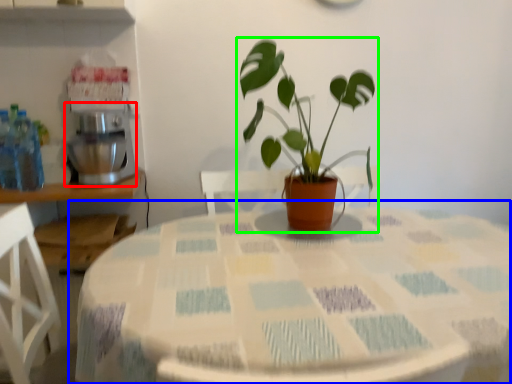
Question: Which object is positioned closest to mixer (highlighted by a red box)? Select from table (highlighted by a blue box) and houseplant (highlighted by a green box).

Choices:
 (A) table
 (B) houseplant

Answer: (B)